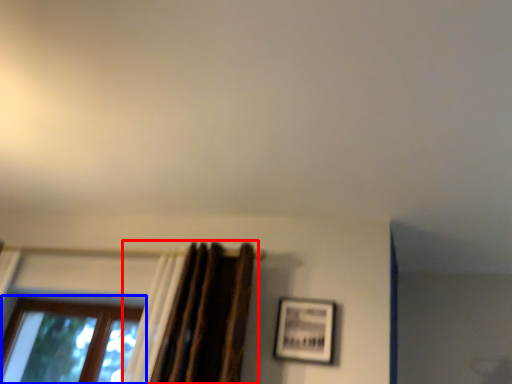
Question: Among these objects, which one is nearest to the camera, curtain (highlighted by a red box) or window (highlighted by a blue box)?

Choices:
 (A) curtain
 (B) window

Answer: (A)